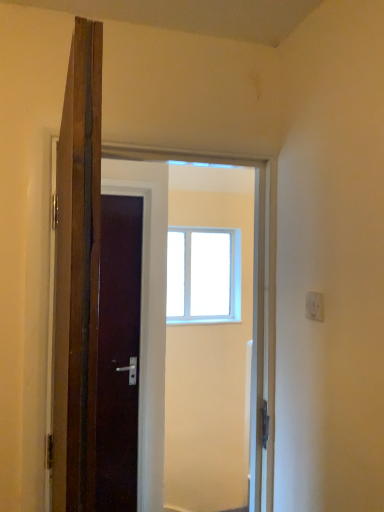
Question: From a real-world perspective, relative to transparent glass window at center, is white plastic electric outlet at upper right vertically above or below?

Choices:
 (A) above
 (B) below

Answer: (B)

Question: Is point (311, 296) closer or farther from the camera than point (196, 317)?

Choices:
 (A) closer
 (B) farther

Answer: (A)

Question: From the image's perspective, relative to transparent glass window at center, is white plastic electric outlet at upper right above or below?

Choices:
 (A) below
 (B) above

Answer: (B)

Question: Looking at the image, does transparent glass window at center seem bigger or smaller compared to white plastic electric outlet at upper right?

Choices:
 (A) small
 (B) big

Answer: (B)

Question: Looking at their shapes, would you say transparent glass window at center is wider or thinner than white plastic electric outlet at upper right?

Choices:
 (A) thin
 (B) wide

Answer: (B)

Question: Is point (195, 302) closer or farther from the camera than point (319, 317)?

Choices:
 (A) farther
 (B) closer

Answer: (A)

Question: From their relative heights in the image, would you say transparent glass window at center is taller or shorter than white plastic electric outlet at upper right?

Choices:
 (A) tall
 (B) short

Answer: (A)